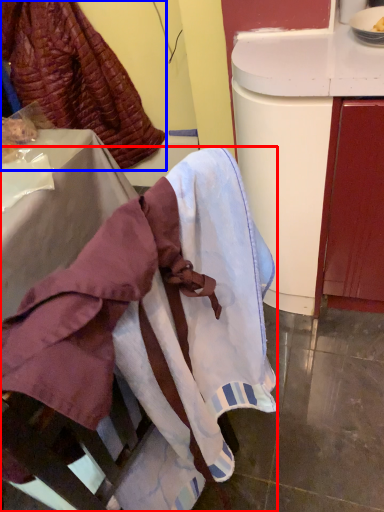
Question: Which object is closer to the camera taking this photo, furniture (highlighted by a red box) or leftover (highlighted by a blue box)?

Choices:
 (A) furniture
 (B) leftover

Answer: (A)